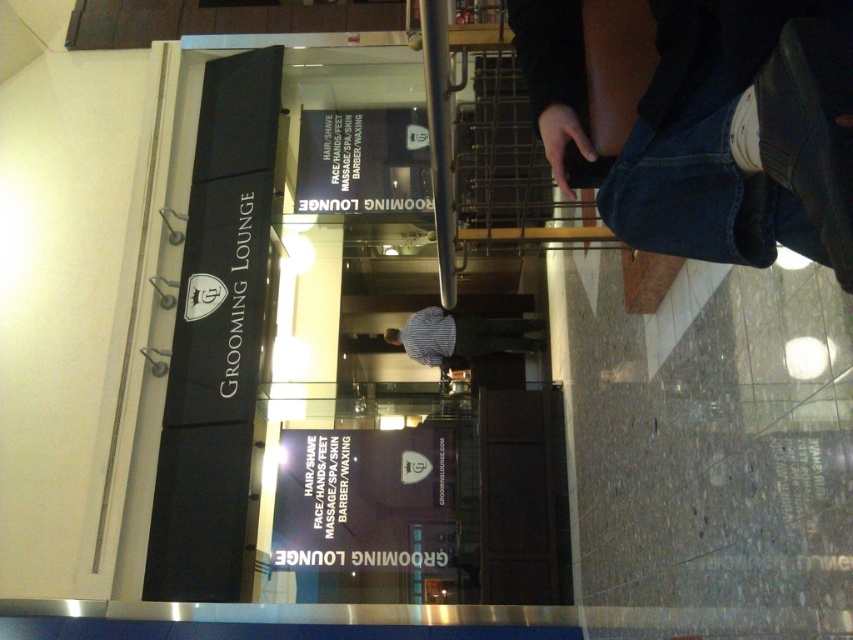
Question: From the image, what is the correct spatial relationship of denim pants at lower right in relation to striped shirt at center?

Choices:
 (A) above
 (B) below

Answer: (A)

Question: Is denim pants at lower right smaller than striped shirt at center?

Choices:
 (A) no
 (B) yes

Answer: (B)

Question: Which point appears closest to the camera in this image?

Choices:
 (A) (724, 202)
 (B) (541, 342)

Answer: (A)

Question: Is denim pants at lower right to the right of striped shirt at center from the viewer's perspective?

Choices:
 (A) no
 (B) yes

Answer: (B)